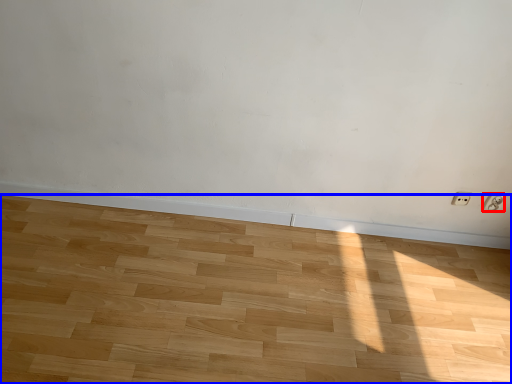
Question: Which object appears closest to the camera in this image, electric outlet (highlighted by a red box) or hardwood (highlighted by a blue box)?

Choices:
 (A) electric outlet
 (B) hardwood

Answer: (B)